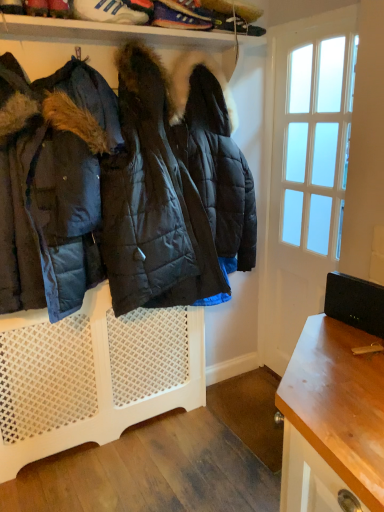
I want to click on free space in front of white mesh radiator at center, so click(115, 476).